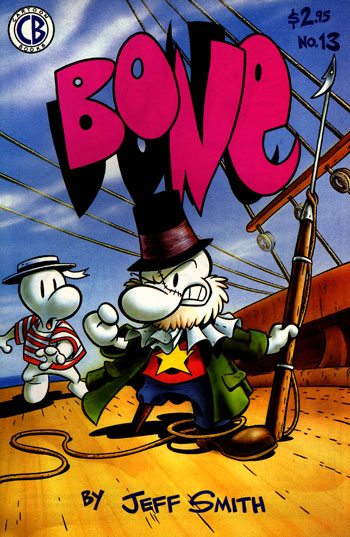
You are a GUI agent. You are given a task and a screenshot of the screen. Output one action in this format:
    pyautogui.click(x=<x>, y=<y>)
    Task: Click on the hook
    Image resolution: width=350 pixels, height=537 pixels.
    Given the screenshot: What is the action you would take?
    pyautogui.click(x=328, y=86)